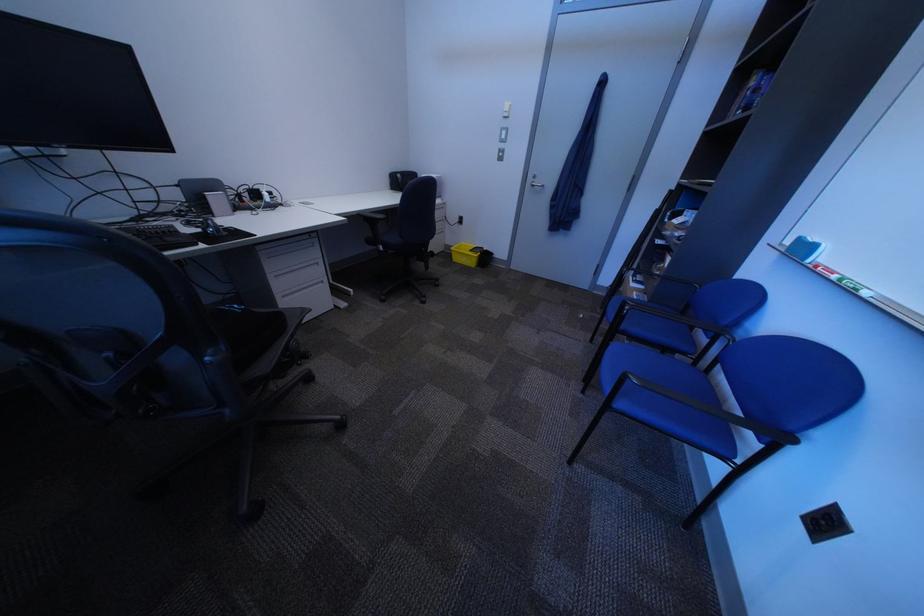
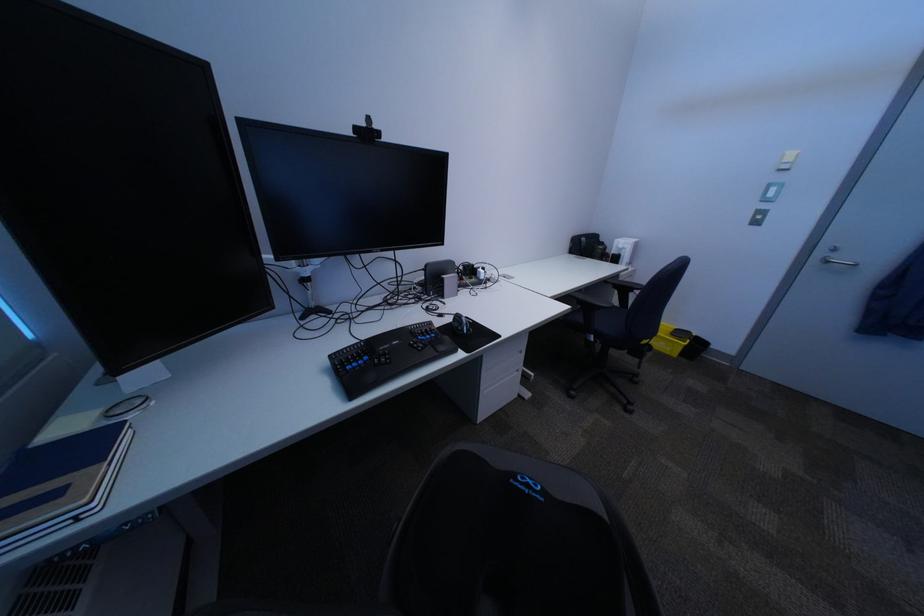
Find the pixel in the second image that matches point (523, 111) in the first image.

(807, 163)